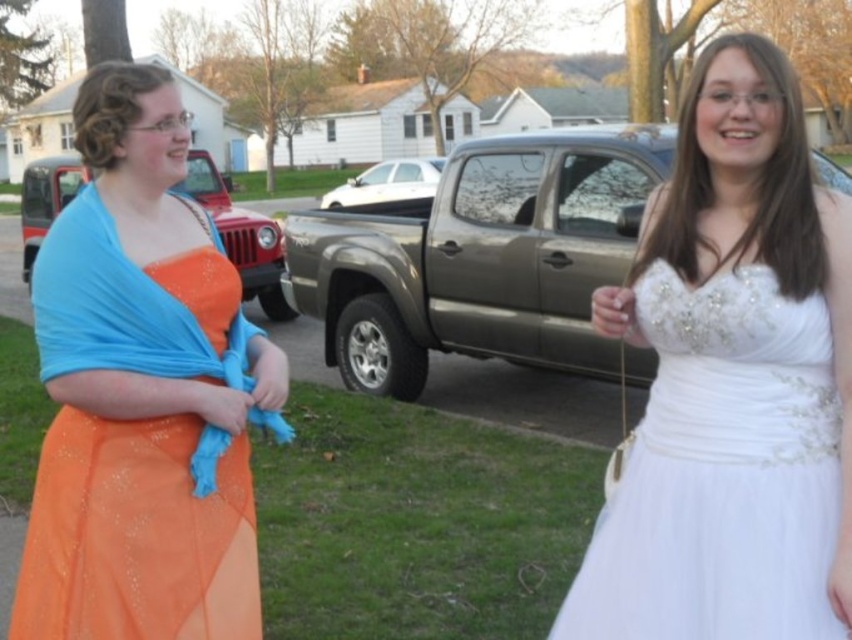
Can you confirm if white satin dress at center is taller than orange satin dress at left?

No, white satin dress at center is not taller than orange satin dress at left.

Between point (724, 113) and point (173, 212), which one is positioned in front?

Point (724, 113) is more forward.

Between point (732, 129) and point (154, 451), which one is positioned behind?

The point (154, 451) is more distant.

Where is `white satin dress at center`? The image size is (852, 640). white satin dress at center is located at coordinates (732, 381).